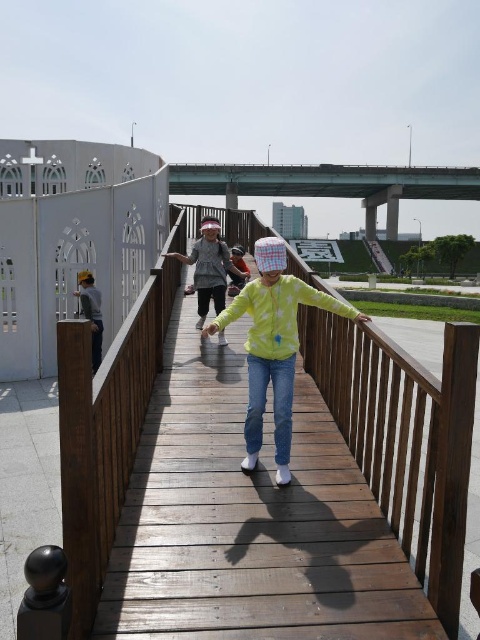
You are a photographer standing on the wooden pedestrian bridge. You want to take a photo of both the yellow matte jacket at center and the dark gray jacket at left. Which jacket should you focus on first if you want to include both in the frame without moving the camera?

The yellow matte jacket at center is much taller than the dark gray jacket at left, so you should focus on the yellow matte jacket at center first to ensure it fits within the frame since it takes up more space.

You are a photographer trying to capture the wooden bridge at center and the yellow matte jacket at center in a single frame. Given the size difference between them, which object should you focus on to ensure both are clearly visible in the photo?

The wooden bridge at center has a larger size compared to the yellow matte jacket at center, so focusing on the wooden bridge at center would ensure both objects are clearly visible in the photo.

You are a delivery robot with a 1.5 meter wide package. You need to move from one end of the bridge to the other. Is there enough space between the light yellow fabric shirt at center and the dark gray jacket at left for your package to pass through?

The distance between the light yellow fabric shirt at center and the dark gray jacket at left is 2.34 meters. Since the package is 1.5 meters wide, there is sufficient space for the package to pass through.